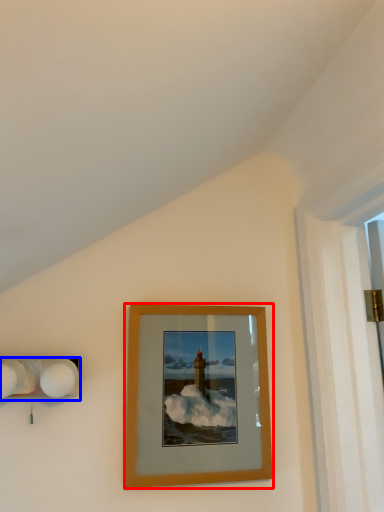
Question: Which object is further to the camera taking this photo, picture frame (highlighted by a red box) or lamp (highlighted by a blue box)?

Choices:
 (A) picture frame
 (B) lamp

Answer: (A)